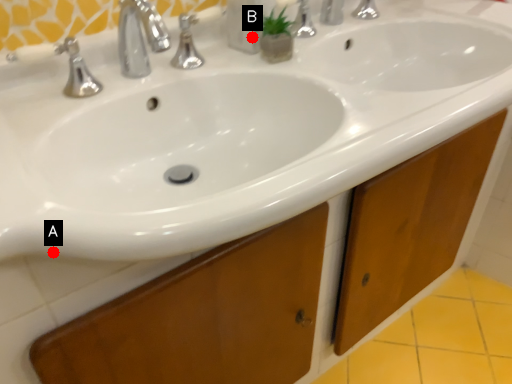
Question: Two points are circled on the image, labeled by A and B beside each circle. Which point is further to the camera?

Choices:
 (A) A is further
 (B) B is further

Answer: (B)